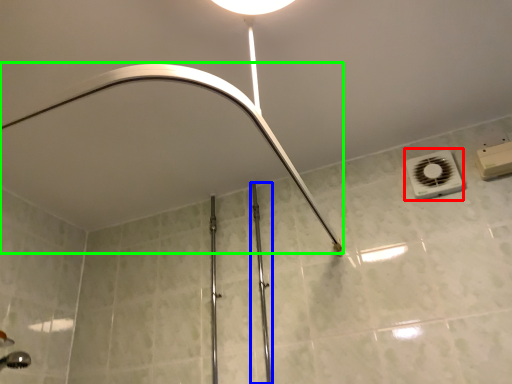
Question: Which object is positioned closest to air conditioning (highlighted by a red box)? Select from rail (highlighted by a blue box) and shower (highlighted by a green box).

Choices:
 (A) rail
 (B) shower

Answer: (B)